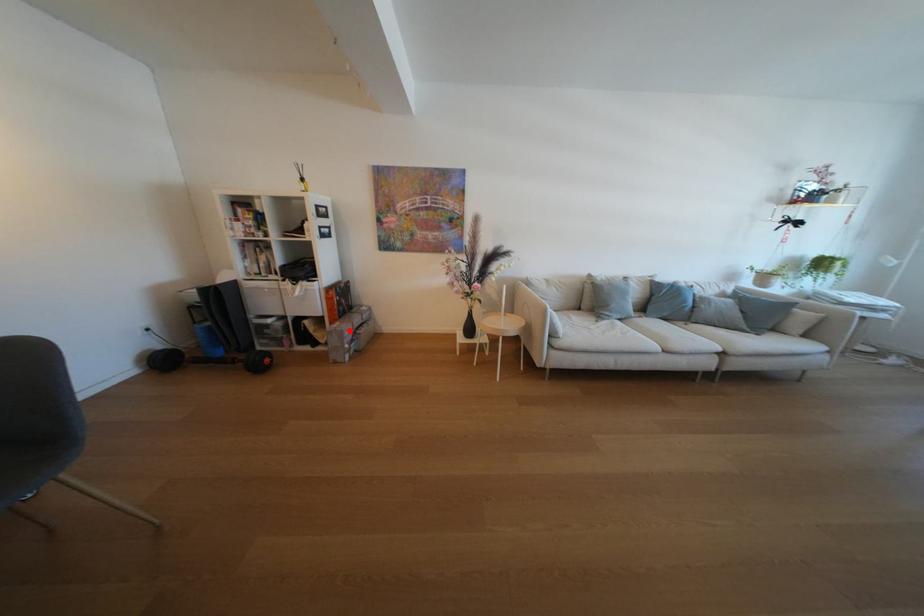
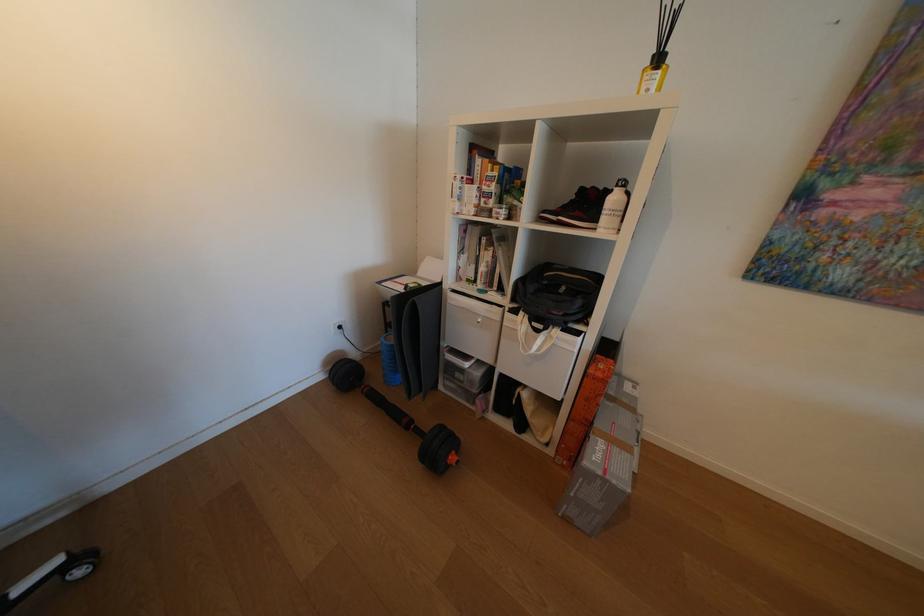
Locate, in the second image, the point that corresponds to the highlighted location in the first image.

(626, 483)